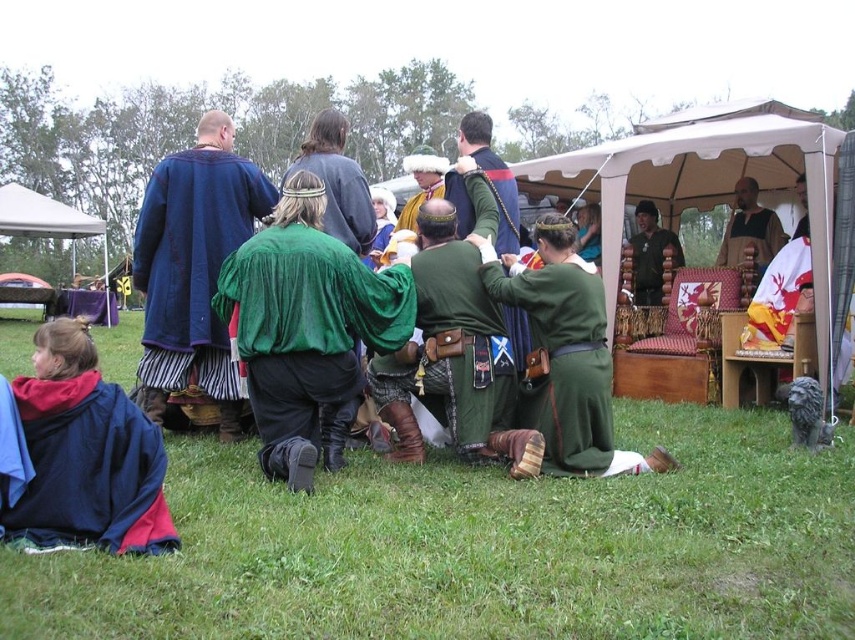
Based on the scene description, where is the wooden chair at center located in terms of coordinates?

The wooden chair at center is located at coordinates point (705, 179).

You are a costume designer observing the scene. You need to determine which garment is shorter between the dark blue fleece jacket at lower left and the velvet blue robe at center. Which one should you note as shorter?

The dark blue fleece jacket at lower left is shorter than the velvet blue robe at center.